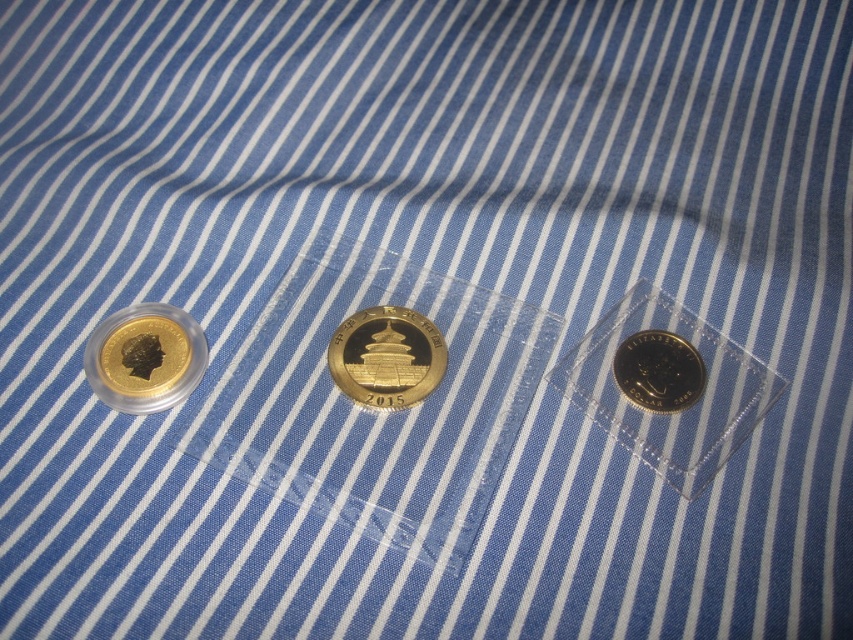
Question: Which of the following is the farthest from the observer?

Choices:
 (A) gold shiny coin at left
 (B) gold plated coin at center
 (C) shiny silver coin at center

Answer: (B)

Question: Which of the following is the farthest from the observer?

Choices:
 (A) shiny silver coin at center
 (B) gold shiny coin at left
 (C) gold coin in clear plastic at center-right

Answer: (A)

Question: Does gold coin in clear plastic at center-right appear on the left side of gold plated coin at center?

Choices:
 (A) no
 (B) yes

Answer: (A)

Question: Estimate the real-world distances between objects in this image. Which object is farther from the gold plated coin at center?

Choices:
 (A) gold coin in clear plastic at center-right
 (B) shiny silver coin at center

Answer: (B)

Question: Does gold coin in clear plastic at center-right appear under shiny silver coin at center?

Choices:
 (A) yes
 (B) no

Answer: (A)

Question: Is gold shiny coin at left positioned before gold plated coin at center?

Choices:
 (A) no
 (B) yes

Answer: (B)